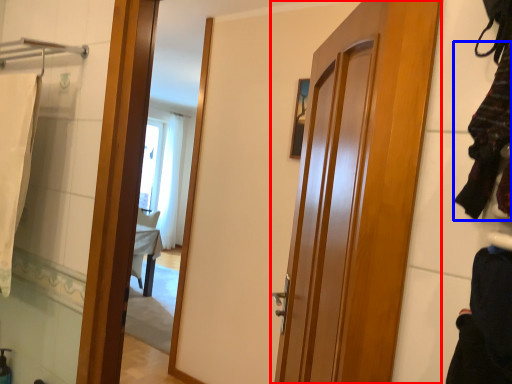
Question: Among these objects, which one is farthest to the camera, door (highlighted by a red box) or clothing (highlighted by a blue box)?

Choices:
 (A) door
 (B) clothing

Answer: (A)